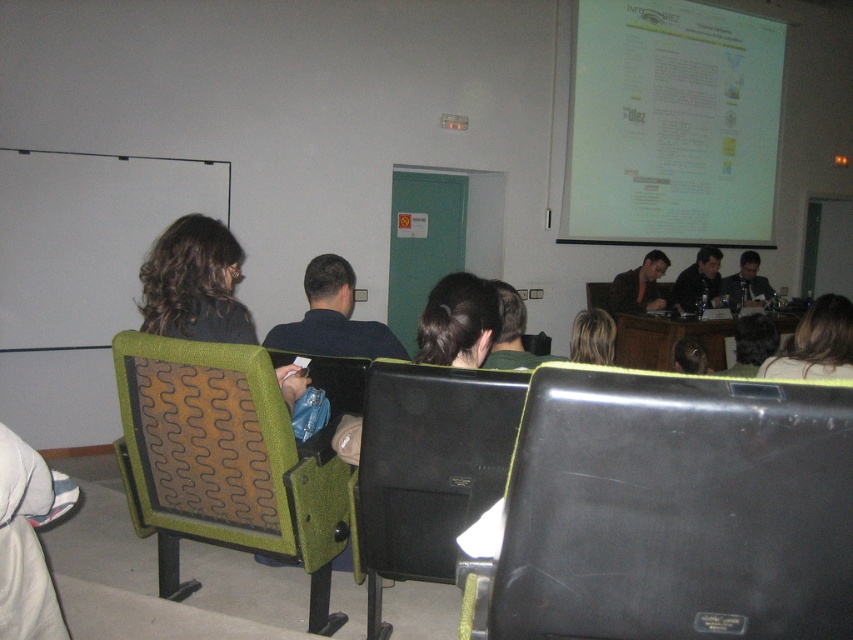
You are standing in the classroom and want to determine which of the two points, point [563,497] or point [714,291], is closer to you. Can you figure out which one is nearer?

Point [563,497] is closer to the camera than point [714,291], so the point closer to you is point [563,497].

You are an attendee in the classroom and want to see the presenter with blonde hair at right. Is the green fabric chair at center blocking your view?

The green fabric chair at center is taller than blonde hair at right, so it would block your view of the presenter with blonde hair at right.

You are an attendee at the presentation and want to retrieve your dark brown leather jacket at center. You are currently sitting in the black leather chair at lower right. Can you reach your jacket without moving from your seat?

The black leather chair at lower right is positioned under dark brown leather jacket at center, so you can easily reach your dark brown leather jacket at center from your current seat without needing to move.